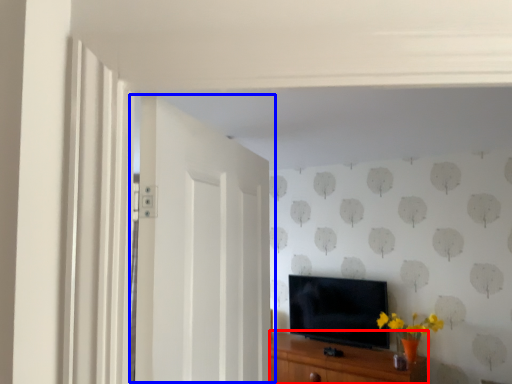
Question: Among these objects, which one is farthest to the camera, cabinetry (highlighted by a red box) or door (highlighted by a blue box)?

Choices:
 (A) cabinetry
 (B) door

Answer: (A)